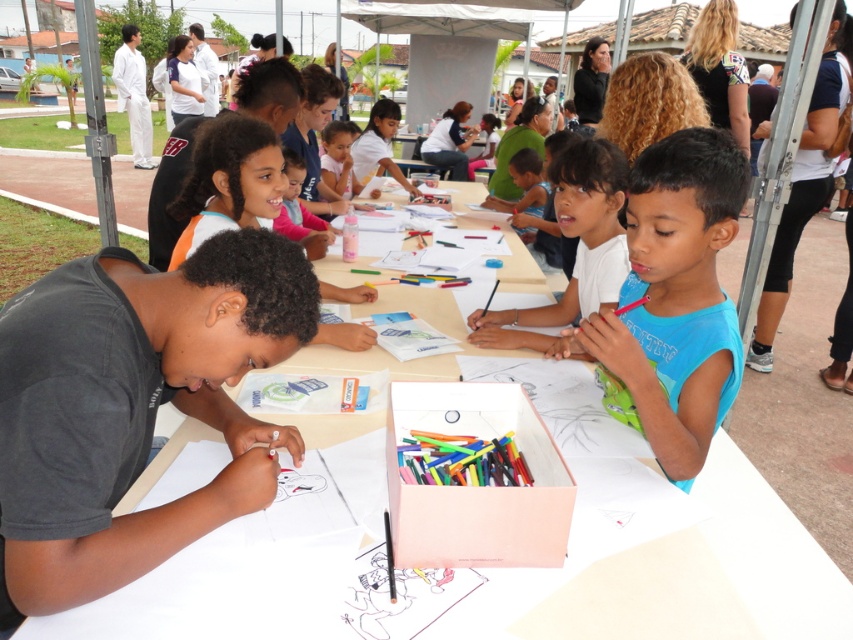
Question: Which is farther from the blue cotton shirt at center?

Choices:
 (A) white paper at center
 (B) matte pink shirt at center
 (C) light blue shirt at center

Answer: (B)

Question: Is white paper at center closer to the viewer compared to matte pink shirt at center?

Choices:
 (A) no
 (B) yes

Answer: (B)

Question: Among these points, which one is nearest to the camera?

Choices:
 (A) (416, 304)
 (B) (326, 138)
 (C) (643, 163)
 (D) (572, 156)

Answer: (C)

Question: Does blue cotton shirt at center appear under matte pink shirt at center?

Choices:
 (A) no
 (B) yes

Answer: (B)

Question: Does blue cotton shirt at center appear over matte pink shirt at center?

Choices:
 (A) no
 (B) yes

Answer: (A)

Question: Which of the following is the farthest from the observer?

Choices:
 (A) light blue shirt at center
 (B) blue cotton shirt at center
 (C) white paper at center

Answer: (A)